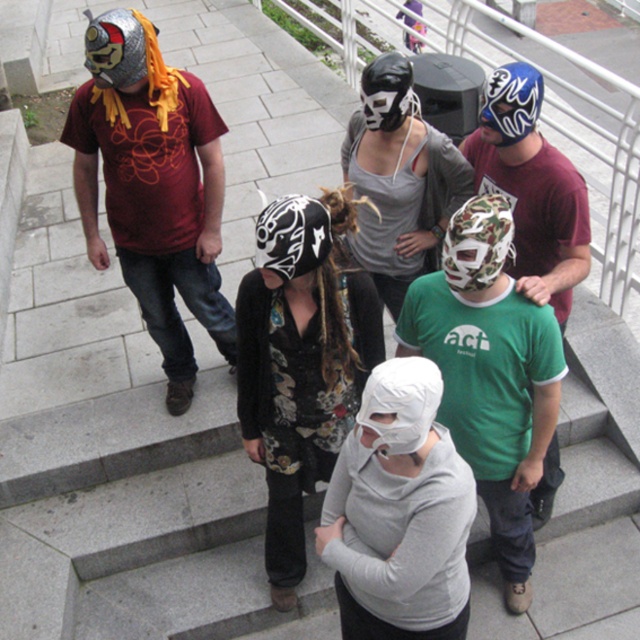
Question: Which is farther from the metallic silver helmet at left?

Choices:
 (A) camo fabric mask at center
 (B) camouflage-patterned mask at center
 (C) black leather jacket at center

Answer: (A)

Question: Which object is closer to the camera taking this photo?

Choices:
 (A) black leather jacket at center
 (B) camouflage-patterned mask at center
 (C) camo-patterned mask at center-right
 (D) matte black mask at center

Answer: (A)

Question: Can you confirm if camo-patterned mask at center-right is thinner than camo fabric mask at center?

Choices:
 (A) yes
 (B) no

Answer: (B)

Question: Does black leather jacket at center appear on the right side of matte black mask at center?

Choices:
 (A) yes
 (B) no

Answer: (B)

Question: Which point is farther from the camera taking this photo?

Choices:
 (A) (497, 364)
 (B) (508, 172)

Answer: (B)

Question: Is matte black mask at center below camo-patterned mask at center-right?

Choices:
 (A) yes
 (B) no

Answer: (B)